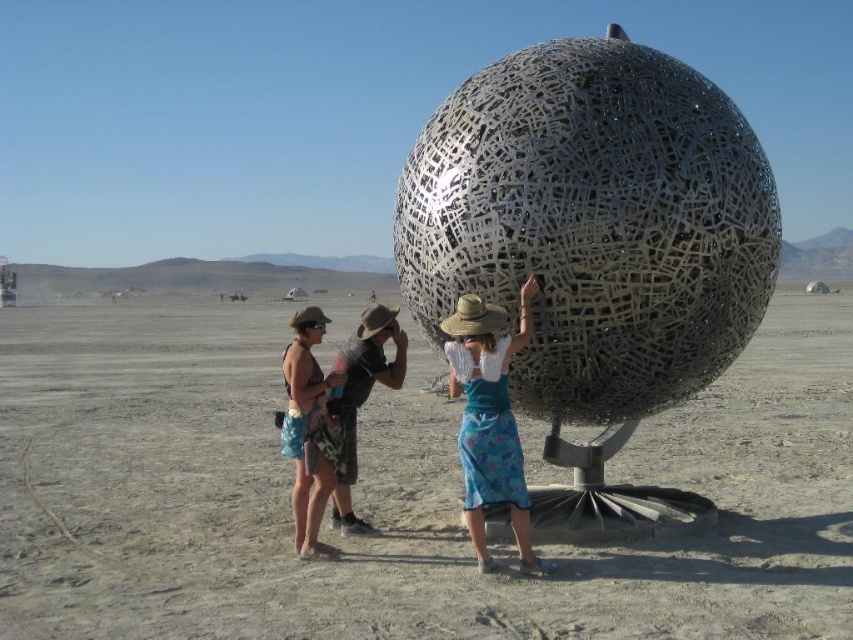
The height and width of the screenshot is (640, 853). Describe the element at coordinates (595, 248) in the screenshot. I see `metallic mesh sphere at center` at that location.

Can you confirm if metallic mesh sphere at center is positioned below camouflage shorts at center?

Incorrect, metallic mesh sphere at center is not positioned below camouflage shorts at center.

What are the coordinates of `metallic mesh sphere at center` in the screenshot? It's located at (595, 248).

Is blue floral skirt at center shorter than camouflage shorts at center?

In fact, blue floral skirt at center may be taller than camouflage shorts at center.

Is blue floral skirt at center below camouflage shorts at center?

Actually, blue floral skirt at center is above camouflage shorts at center.

At what (x,y) coordinates should I click in order to perform the action: click on blue floral skirt at center. Please return your answer as a coordinate pair (x, y). This screenshot has width=853, height=640. Looking at the image, I should click on (489, 419).

The height and width of the screenshot is (640, 853). Find the location of `blue floral skirt at center`. blue floral skirt at center is located at coordinates (489, 419).

Can you confirm if metallic sphere at center is bigger than blue floral skirt at center?

Correct, metallic sphere at center is larger in size than blue floral skirt at center.

Where is `metallic sphere at center`? The image size is (853, 640). metallic sphere at center is located at coordinates (392, 493).